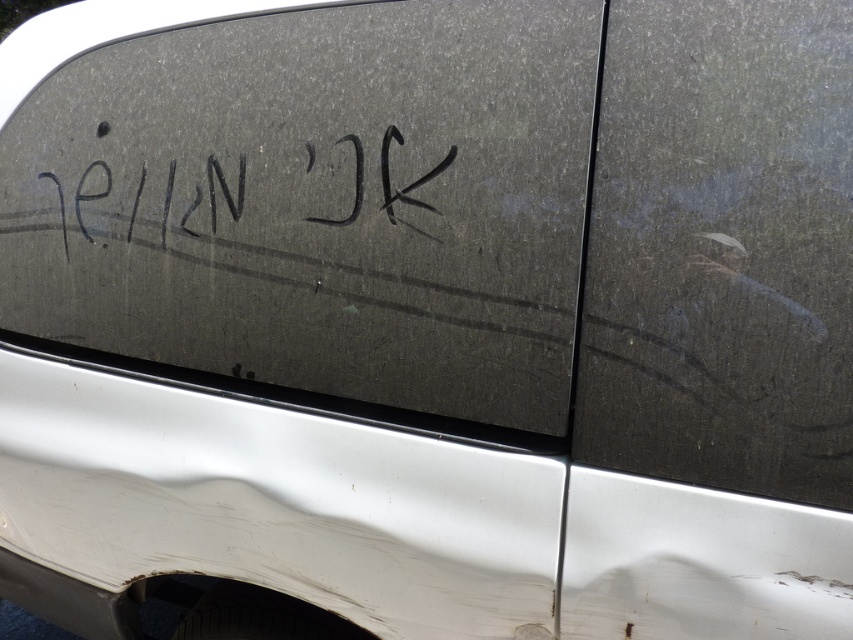
Is matte black window at center positioned in front of black ink writing at center?

Yes, it is.

Which is below, matte black window at center or black ink writing at center?

Positioned lower is matte black window at center.

Find the location of a particular element. This screenshot has width=853, height=640. matte black window at center is located at coordinates (317, 202).

Image resolution: width=853 pixels, height=640 pixels. Find the location of `matte black window at center`. matte black window at center is located at coordinates (317, 202).

Describe the element at coordinates (722, 250) in the screenshot. I see `matte black glass at center` at that location.

Is matte black glass at center taller than black ink writing at center?

Correct, matte black glass at center is much taller as black ink writing at center.

Is point (683, 141) more distant than point (242, 170)?

No, it is in front of (242, 170).

Where is `matte black glass at center`? The height and width of the screenshot is (640, 853). matte black glass at center is located at coordinates (722, 250).

Does point (230, 346) come farther from viewer compared to point (614, 406)?

That is True.

Looking at this image, does matte black window at center appear under matte black glass at center?

Actually, matte black window at center is above matte black glass at center.

What do you see at coordinates (317, 202) in the screenshot? The image size is (853, 640). I see `matte black window at center` at bounding box center [317, 202].

Where is `matte black window at center`? The image size is (853, 640). matte black window at center is located at coordinates (317, 202).